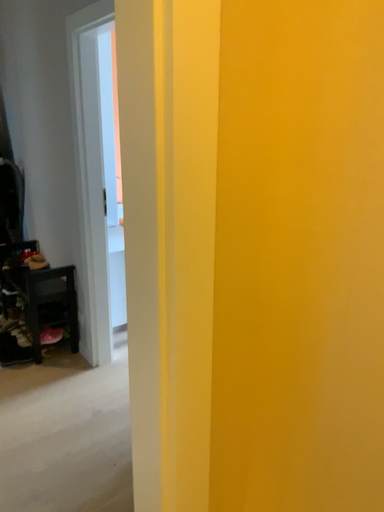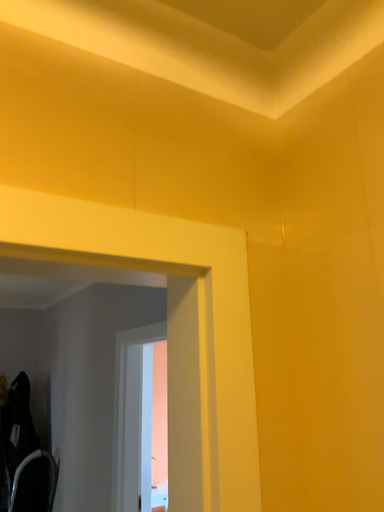
Question: How did the camera likely rotate when shooting the video?

Choices:
 (A) rotated upward
 (B) rotated downward

Answer: (A)